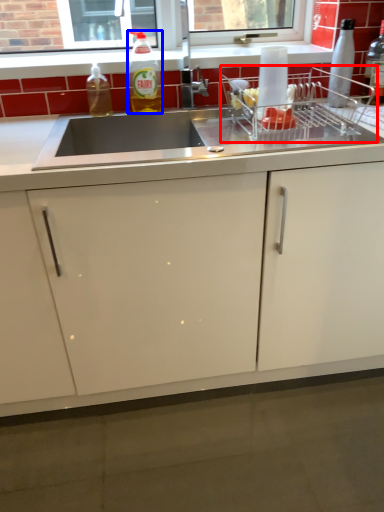
Question: Which object appears farthest to the camera in this image, appliance (highlighted by a red box) or bottle (highlighted by a blue box)?

Choices:
 (A) appliance
 (B) bottle

Answer: (B)